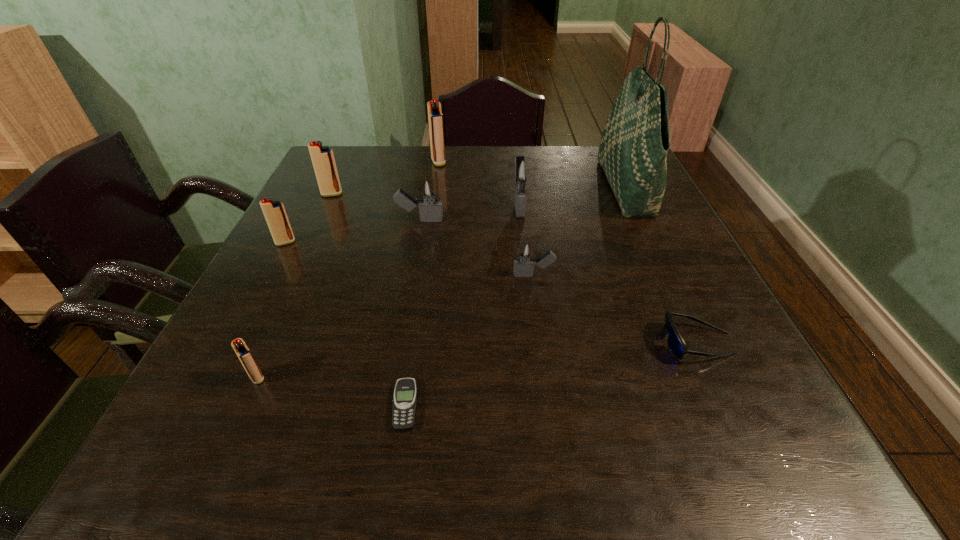
Find the location of a particular element. the smallest red igniter is located at coordinates (245, 356).

At what (x,y) coordinates should I click in order to perform the action: click on the smallest gray igniter. Please return your answer as a coordinate pair (x, y). Looking at the image, I should click on (524, 251).

Locate an element on the screen. The width and height of the screenshot is (960, 540). the nearest gray igniter is located at coordinates (524, 251).

The height and width of the screenshot is (540, 960). Identify the location of the eighth farthest object. (675, 342).

The image size is (960, 540). Identify the location of sunglasses. (675, 342).

This screenshot has height=540, width=960. I want to click on the shortest object, so click(x=404, y=403).

This screenshot has height=540, width=960. What are the coordinates of `beeper` in the screenshot? It's located at pos(404,403).

In order to click on vacant space situated 0.330m on the left of the green tote bag in this screenshot , I will do `click(485, 188)`.

This screenshot has width=960, height=540. Find the location of `free space located on the front of the farthest red igniter`. free space located on the front of the farthest red igniter is located at coordinates (429, 227).

Locate an element on the screen. blank space located on the front of the second biggest red igniter is located at coordinates (289, 285).